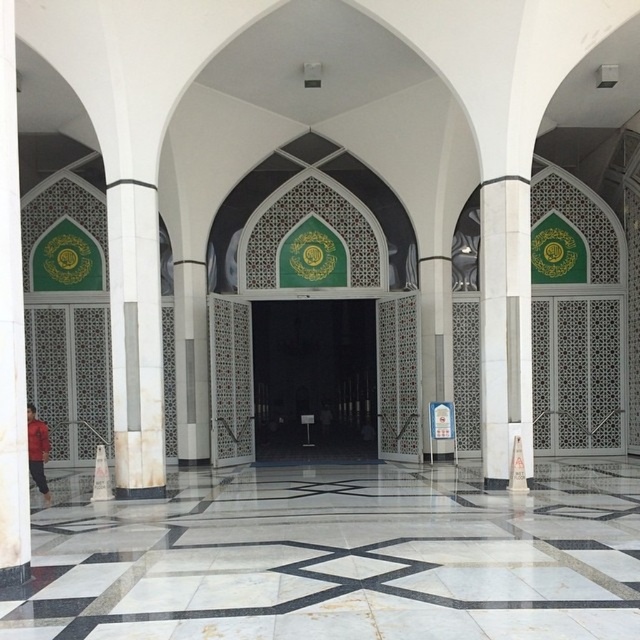
Question: Which object appears closest to the camera in this image?

Choices:
 (A) white marble pillar at left
 (B) transparent glass door at center

Answer: (A)

Question: Is transparent glass door at center to the right of white marble pillar at left from the viewer's perspective?

Choices:
 (A) no
 (B) yes

Answer: (B)

Question: Which point appears closest to the camera in this image?

Choices:
 (A) (19, 444)
 (B) (369, 416)

Answer: (A)

Question: Does transparent glass door at center appear under white marble pillar at left?

Choices:
 (A) no
 (B) yes

Answer: (B)

Question: Can you confirm if transparent glass door at center is wider than white marble pillar at left?

Choices:
 (A) no
 (B) yes

Answer: (B)